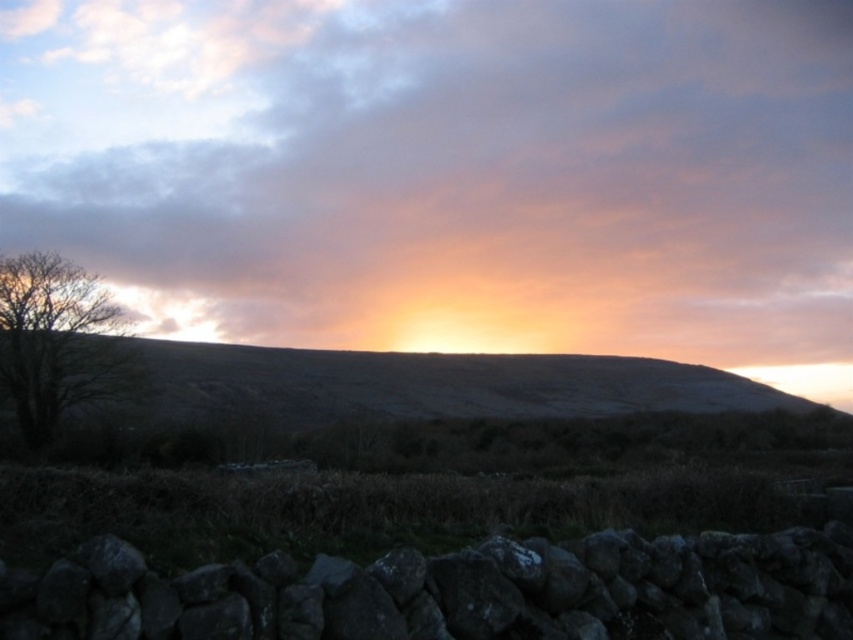
You are an artist trying to paint the scene. You want to ensure the cloudy sky at upper center and the brown leafless tree at left are proportionally accurate. Which object should be drawn taller?

The cloudy sky at upper center should be drawn taller than the brown leafless tree at left according to the description.

You are an artist trying to paint the scene. You notice the cloudy sky at upper center and the brown leafless tree at left. Which object is located to the right of the other?

The cloudy sky at upper center is positioned on the right side of brown leafless tree at left.

You are an artist planning to paint the scene. You want to ensure the cloudy sky at upper center and the brown leafless tree at left are proportionally accurate. Which object should you make larger in your painting?

The cloudy sky at upper center should be made larger than the brown leafless tree at left because it is described as larger in size.